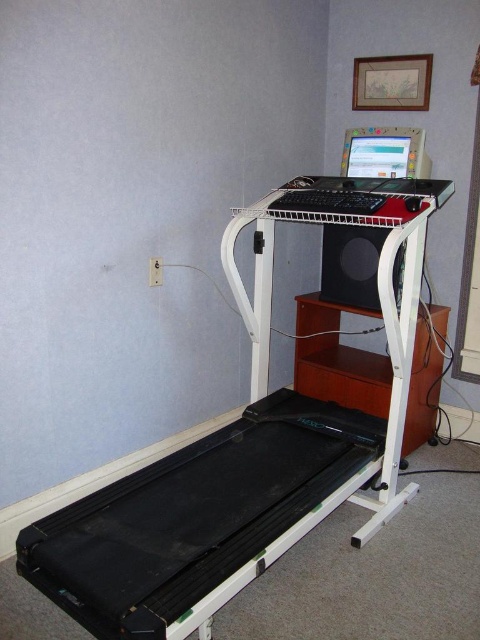
Question: Is white plastic computer desk at center below matte plastic monitor at upper center?

Choices:
 (A) no
 (B) yes

Answer: (B)

Question: Is white plastic computer desk at center above matte plastic monitor at upper center?

Choices:
 (A) yes
 (B) no

Answer: (B)

Question: Can you confirm if white plastic computer desk at center is positioned to the left of matte plastic monitor at upper center?

Choices:
 (A) no
 (B) yes

Answer: (B)

Question: Among these points, which one is farthest from the camera?

Choices:
 (A) (425, 218)
 (B) (362, 148)

Answer: (B)

Question: Estimate the real-world distances between objects in this image. Which object is farther from the black rubber treadmill at lower left?

Choices:
 (A) matte plastic monitor at upper center
 (B) white plastic computer desk at center

Answer: (A)

Question: Considering the real-world distances, which object is closest to the matte plastic monitor at upper center?

Choices:
 (A) white plastic computer desk at center
 (B) black rubber treadmill at lower left
 (C) black matte speaker at center

Answer: (C)